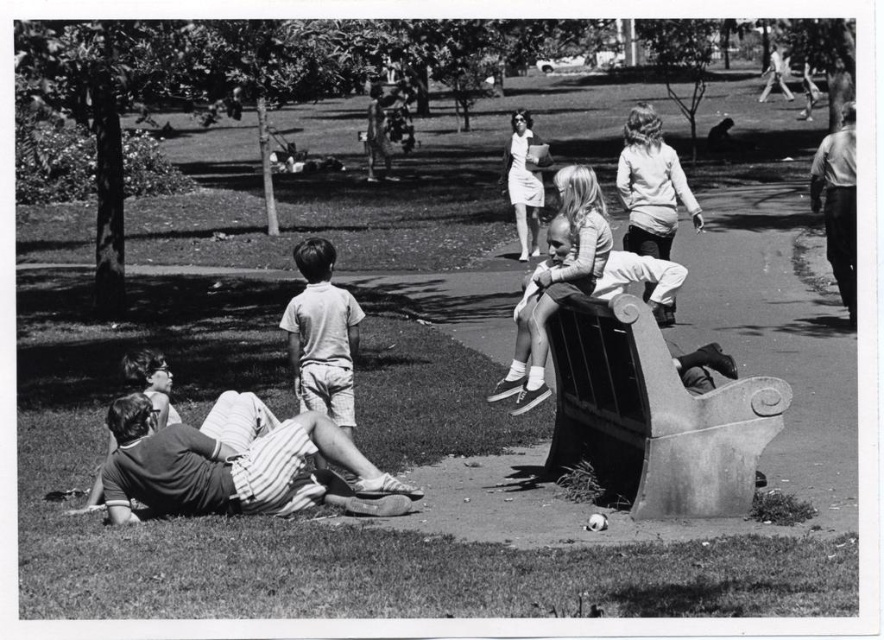
You are a photographer who wants to capture a closeup of the striped cotton shorts at lower left without including the smooth stone bench at center right in the frame. Given their sizes, is this possible?

The smooth stone bench at center right is larger in size than striped cotton shorts at lower left, so it might be challenging to exclude the bench from the frame if they are positioned in a way that the bench overlaps or is too close to the shorts. However, adjusting the camera angle or moving closer to the striped cotton shorts at lower left could help isolate the subject.

You are standing at the center of the park and see the striped cotton shorts at lower left. Based on their position, which direction should you walk to reach them?

The striped cotton shorts at lower left are located at point (237, 468), which is to the lower left direction from your current position at the center. You should walk towards the lower left to reach them.